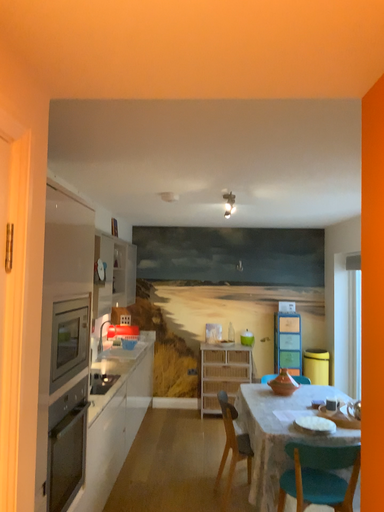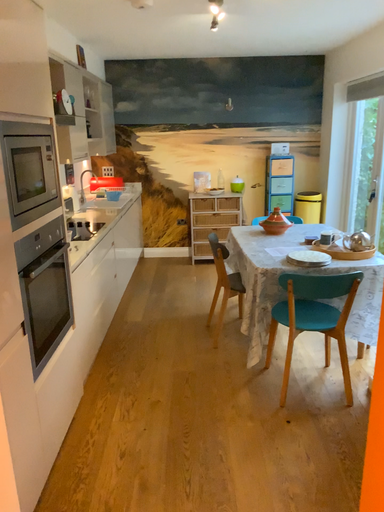
Question: Which way did the camera rotate in the video?

Choices:
 (A) rotated downward
 (B) rotated upward

Answer: (A)